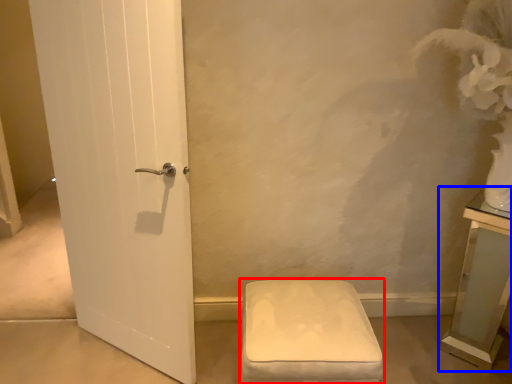
Question: Which point is further to the camera, furniture (highlighted by a red box) or vanity (highlighted by a blue box)?

Choices:
 (A) furniture
 (B) vanity

Answer: (B)